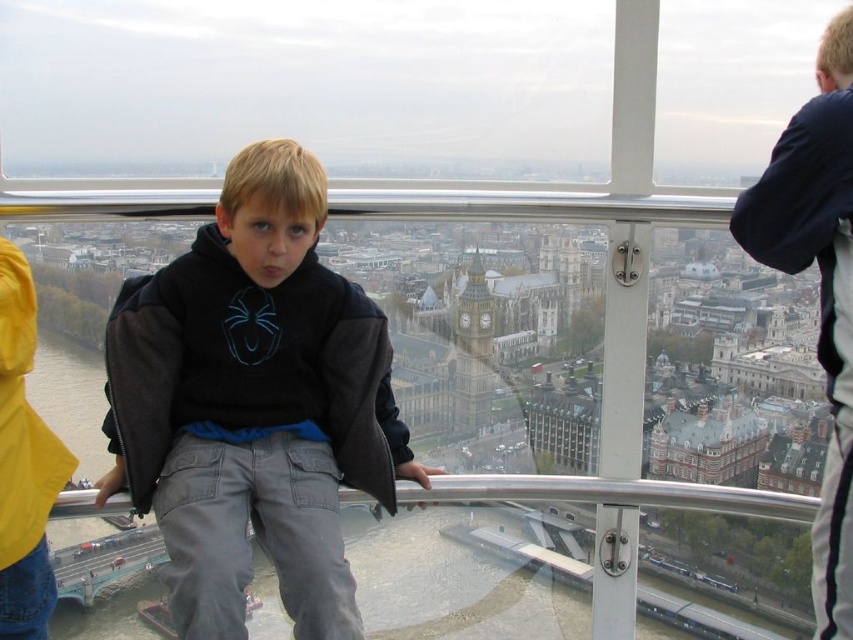
You are a photographer trying to capture a photo of the dark gray hoodie at center and the matte gray clock tower at center through the observation pod window. However, your camera lens has a maximum width capacity of 1.2 meters. Can both objects fit side by side within the frame without overlapping?

The dark gray hoodie at center is wider than the matte gray clock tower at center. Since the camera lens has a maximum width capacity of 1.2 meters, both objects can fit side by side within the frame as long as their combined width does not exceed 1.2 meters. However, the exact feasibility depends on their actual dimensions and the distance from the lens.

You are standing inside the observation pod of the London Eye. You want to reach a specific point marked at coordinates point (183, 604). If your height is 5 feet, can you safely touch this point without stretching?

The distance of point (183, 604) from viewer is 214.08 feet, so no, you cannot safely touch this point as it is much farther away than your height of 5 feet.